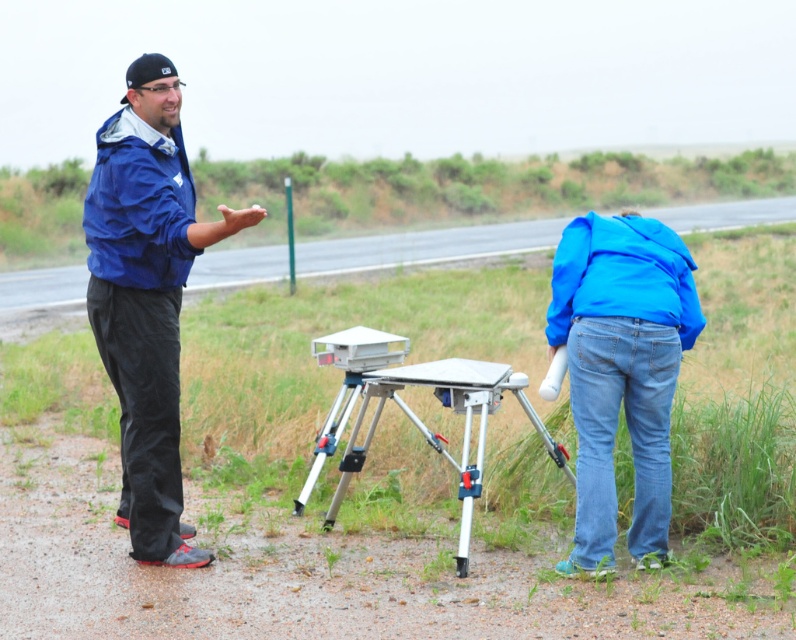
Can you confirm if blue matte jacket at left is taller than silver metallic tripod at center?

Yes.

Is point (170, 179) behind point (344, 426)?

No, (170, 179) is in front of (344, 426).

The image size is (796, 640). Describe the element at coordinates (146, 296) in the screenshot. I see `blue matte jacket at left` at that location.

Where is `blue matte jacket at left`? blue matte jacket at left is located at coordinates (146, 296).

Is blue denim jeans at lower right smaller than silver metallic tripod at center?

Yes.

Who is shorter, blue denim jeans at lower right or silver metallic tripod at center?

With less height is silver metallic tripod at center.

Describe the element at coordinates (621, 371) in the screenshot. I see `blue denim jeans at lower right` at that location.

Where is `blue denim jeans at lower right`? blue denim jeans at lower right is located at coordinates (621, 371).

Is the position of blue matte jacket at left more distant than that of blue denim jeans at lower right?

Yes, blue matte jacket at left is further from the viewer.

Which is below, blue matte jacket at left or blue denim jeans at lower right?

blue denim jeans at lower right

In order to click on blue matte jacket at left in this screenshot , I will do `click(146, 296)`.